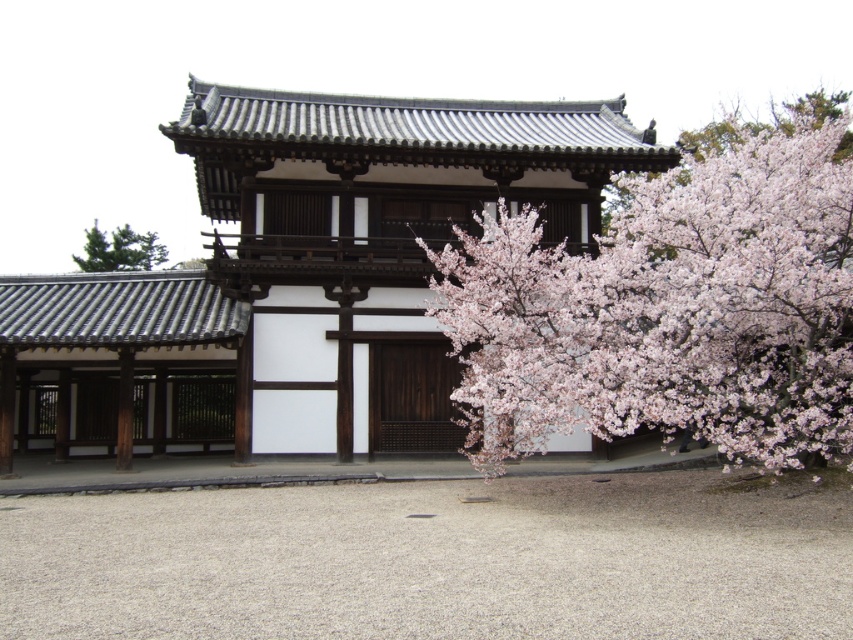
Question: Can you confirm if pink blossoms at right is wider than white wood building at center?

Choices:
 (A) no
 (B) yes

Answer: (B)

Question: Observing the image, what is the correct spatial positioning of pink blossoms at right in reference to matte gray wood at left?

Choices:
 (A) right
 (B) left

Answer: (A)

Question: Among these points, which one is nearest to the camera?

Choices:
 (A) (715, 304)
 (B) (381, 440)
 (C) (97, 269)
 (D) (90, 348)

Answer: (A)

Question: Can you confirm if pink blossoms at right is positioned to the right of matte gray wood at left?

Choices:
 (A) yes
 (B) no

Answer: (A)

Question: Estimate the real-world distances between objects in this image. Which object is farther from the pink blossoms at right?

Choices:
 (A) white wood building at center
 (B) green textured tree at upper left
 (C) matte gray wood at left

Answer: (B)

Question: Which object is the closest to the white wood building at center?

Choices:
 (A) green textured tree at upper left
 (B) matte gray wood at left
 (C) pink blossoms at right

Answer: (B)